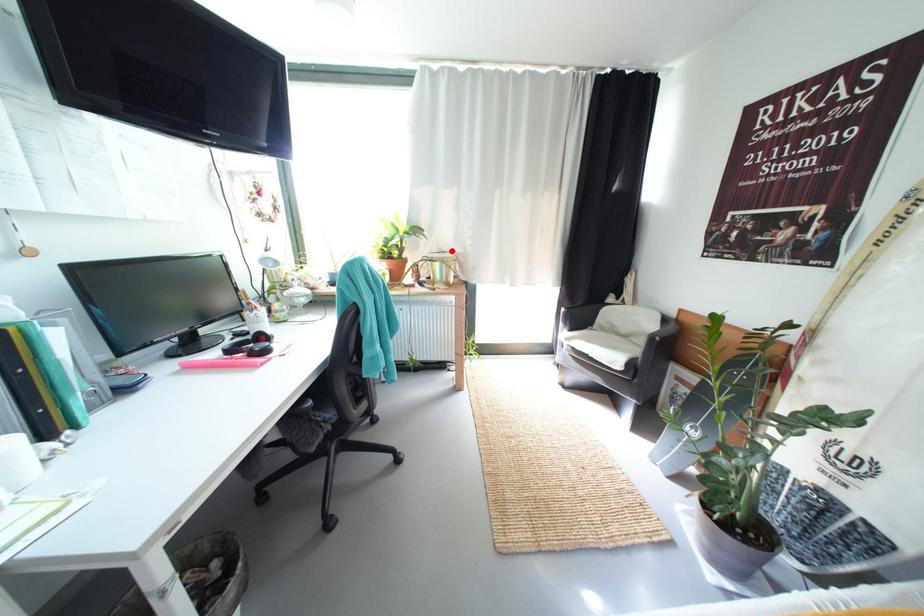
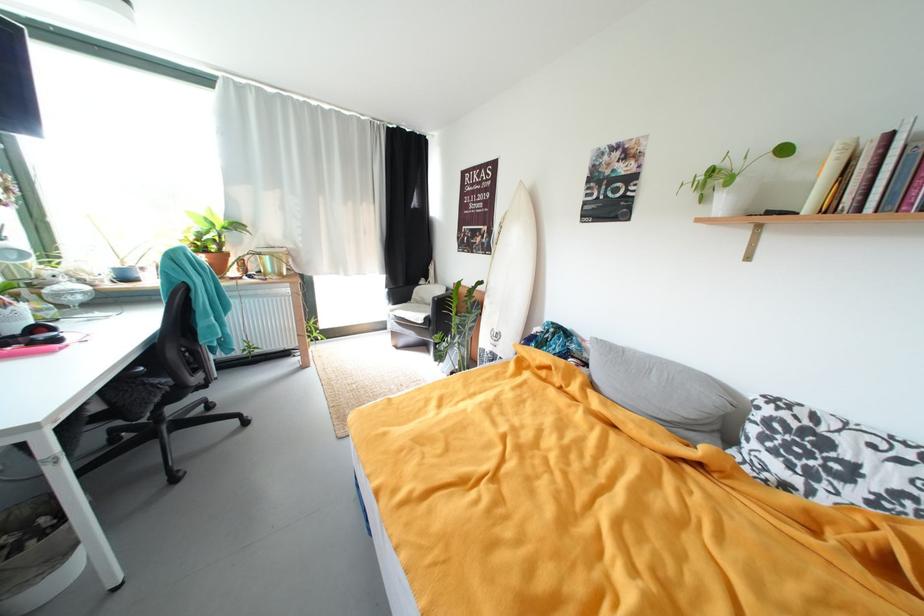
Question: I am providing you with two images of the same scene from different viewpoints. In image1, a red point is highlighted. Considering the same 3D point in image2, which of the following is correct?

Choices:
 (A) It is closer
 (B) It is farther

Answer: (B)